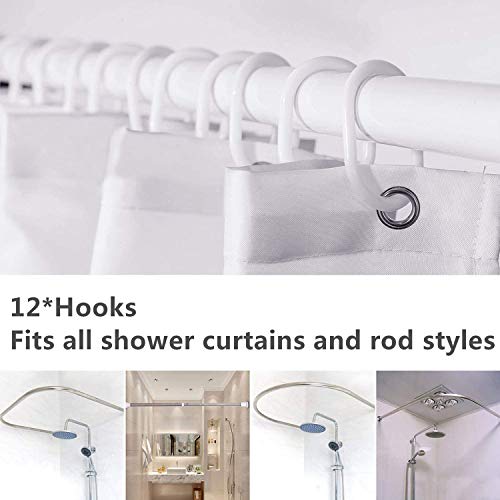
Where is `curtain`? curtain is located at coordinates (457, 204).